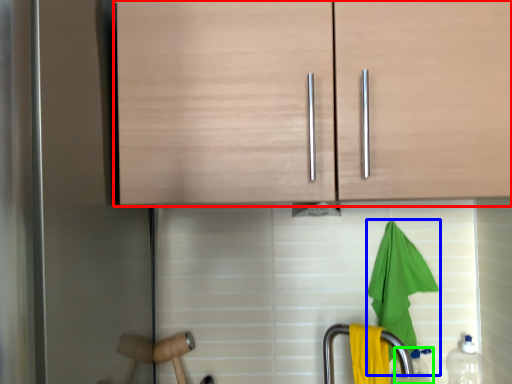
Question: Which object is the closest to the cabinetry (highlighted by a red box)? Choose among these: beach towel (highlighted by a blue box) or bottle (highlighted by a green box).

Choices:
 (A) beach towel
 (B) bottle

Answer: (A)